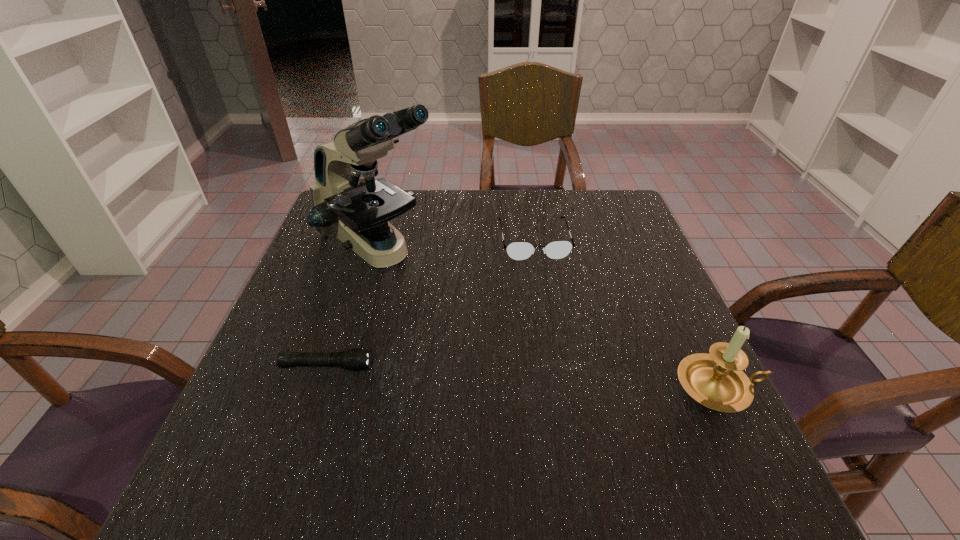
At what (x,y) coordinates should I click in order to perform the action: click on vacant space on the desktop that is between the flashlight and the candle holder and is positioned on the lenses of the third object from left to right. Please return your answer as a coordinate pair (x, y). Looking at the image, I should click on (565, 379).

Find the location of a particular element. free spot on the desktop that is between the shortest object and the candle holder and is positioned through the eyepieces of the tallest object is located at coordinates (540, 377).